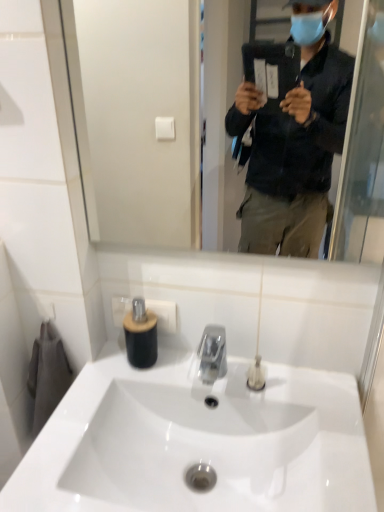
Locate an element on the screen. This screenshot has height=512, width=384. vacant area situated to the left side of clear plastic tube at center, which ranks as the 2th toiletry in left-to-right order is located at coordinates (195, 375).